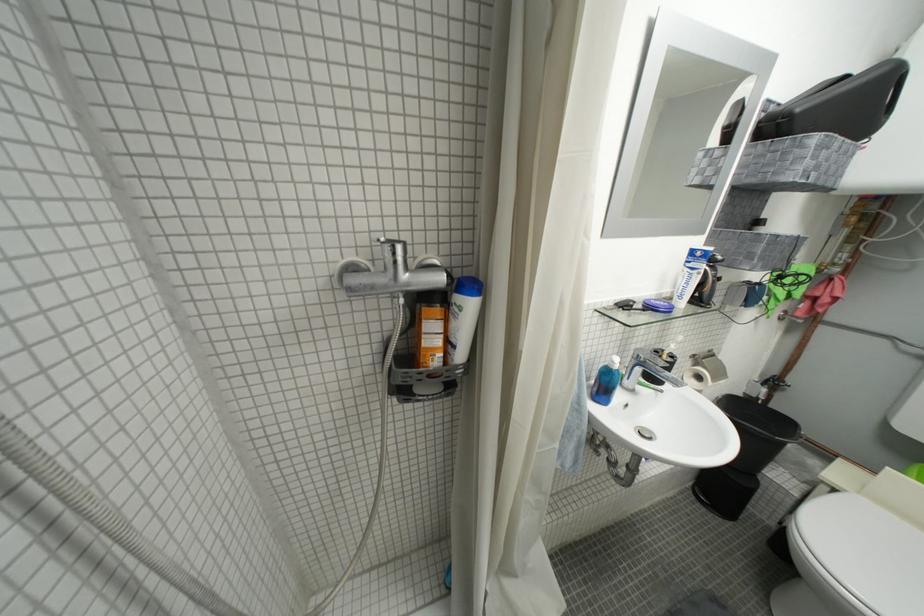
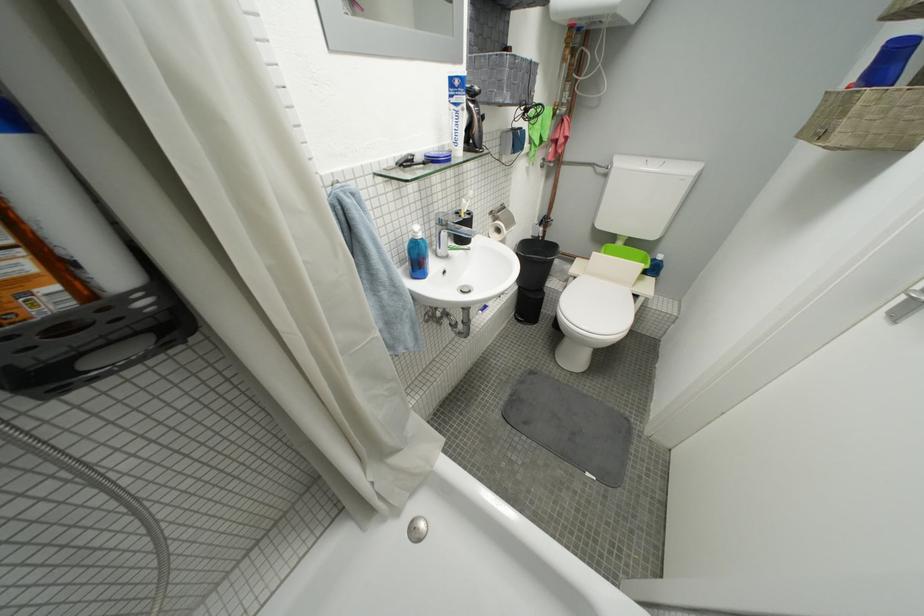
In the second image, find the point that corresponds to [689,299] in the first image.

(465, 145)